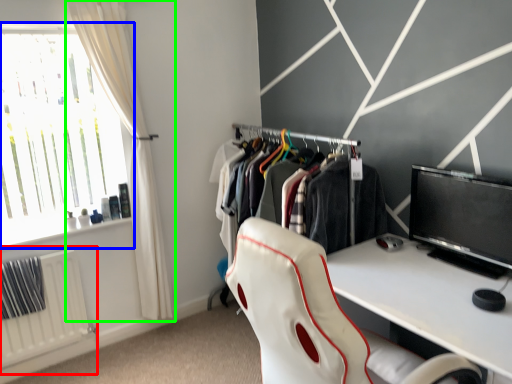
Question: Estimate the real-world distances between objects in this image. Which object is closer to radiator (highlighted by a red box), window (highlighted by a blue box) or curtain (highlighted by a green box)?

Choices:
 (A) window
 (B) curtain

Answer: (A)